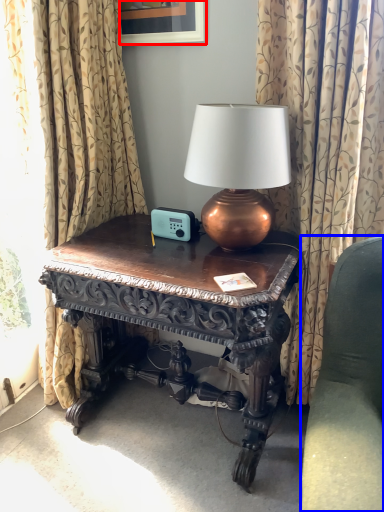
Question: Which point is further to the camera, picture frame (highlighted by a red box) or studio couch (highlighted by a blue box)?

Choices:
 (A) picture frame
 (B) studio couch

Answer: (A)